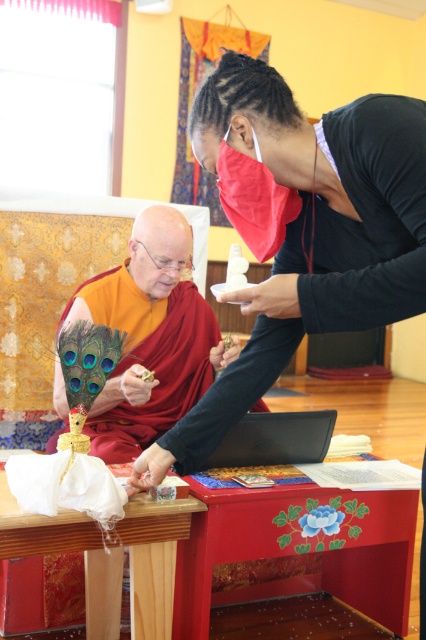
Question: Can you confirm if orange silk robe at center is bigger than shiny gold statue at center?

Choices:
 (A) no
 (B) yes

Answer: (A)

Question: Can you confirm if orange silk robe at center is smaller than shiny gold statue at center?

Choices:
 (A) no
 (B) yes

Answer: (B)

Question: Which object is farther from the camera taking this photo?

Choices:
 (A) shiny gold statue at center
 (B) orange silk robe at center

Answer: (A)

Question: Which point appears closest to the camera in this image?

Choices:
 (A) (54, 449)
 (B) (339, 259)

Answer: (B)

Question: Which of the following is the farthest from the observer?

Choices:
 (A) (405, 184)
 (B) (124, 292)

Answer: (B)

Question: Considering the relative positions of orange silk robe at center and shiny gold statue at center in the image provided, where is orange silk robe at center located with respect to shiny gold statue at center?

Choices:
 (A) left
 (B) right

Answer: (B)